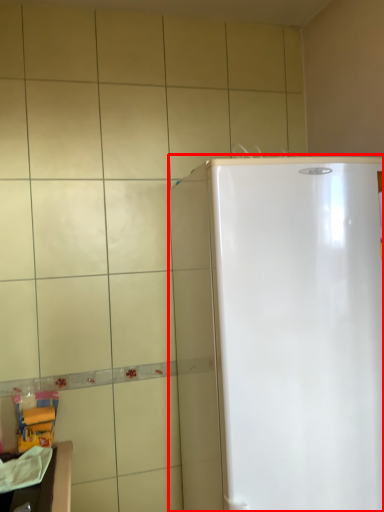
Question: From the image's perspective, what is the correct spatial positioning of refrigerator (annotated by the red box) in reference to counter top?

Choices:
 (A) below
 (B) above

Answer: (B)